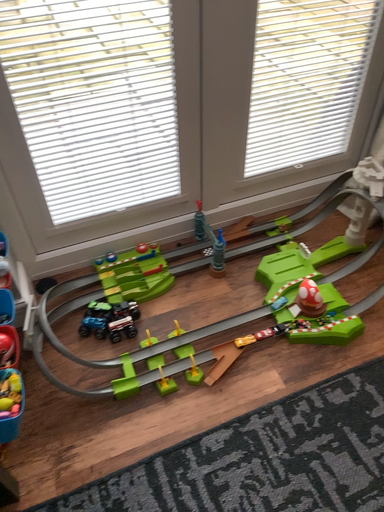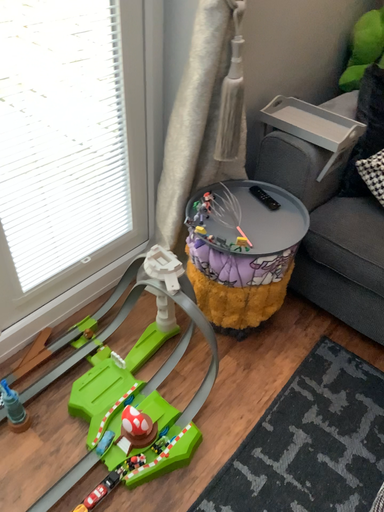
Question: How did the camera likely rotate when shooting the video?

Choices:
 (A) rotated downward
 (B) rotated upward

Answer: (B)